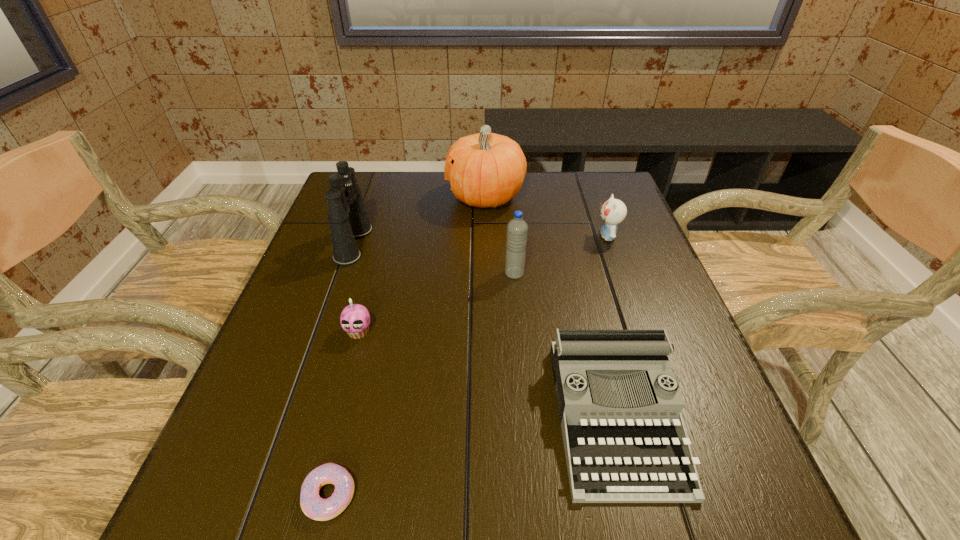
I want to click on doughnut at the near edge, so click(x=313, y=506).

Image resolution: width=960 pixels, height=540 pixels. Identify the location of binoculars at the left edge. (347, 215).

You are a GUI agent. You are given a task and a screenshot of the screen. Output one action in this format:
    pyautogui.click(x=<x>, y=<y>)
    Task: Click on the cupcake located at the left edge
    The width and height of the screenshot is (960, 540).
    Given the screenshot: What is the action you would take?
    tap(355, 319)

Locate an element on the screen. The height and width of the screenshot is (540, 960). doughnut positioned at the left edge is located at coordinates (313, 506).

You are a GUI agent. You are given a task and a screenshot of the screen. Output one action in this format:
    pyautogui.click(x=<x>, y=<y>)
    Task: Click on the kitten that is at the right edge
    
    Given the screenshot: What is the action you would take?
    pyautogui.click(x=613, y=211)

I want to click on typewriter at the right edge, so click(620, 406).

This screenshot has width=960, height=540. Identify the location of object at the near left corner. (313, 506).

Where is `object at the near right corner`? This screenshot has width=960, height=540. object at the near right corner is located at coordinates (620, 406).

Locate an element on the screen. free point at the far edge is located at coordinates (533, 211).

I want to click on blank space at the near edge of the desktop, so click(624, 522).